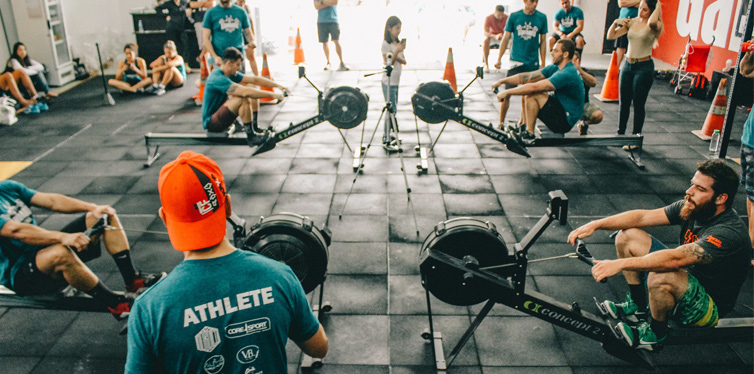
Find the location of a particular element. The width and height of the screenshot is (754, 374). rowing machines is located at coordinates (466, 245), (299, 233), (342, 97), (440, 96).